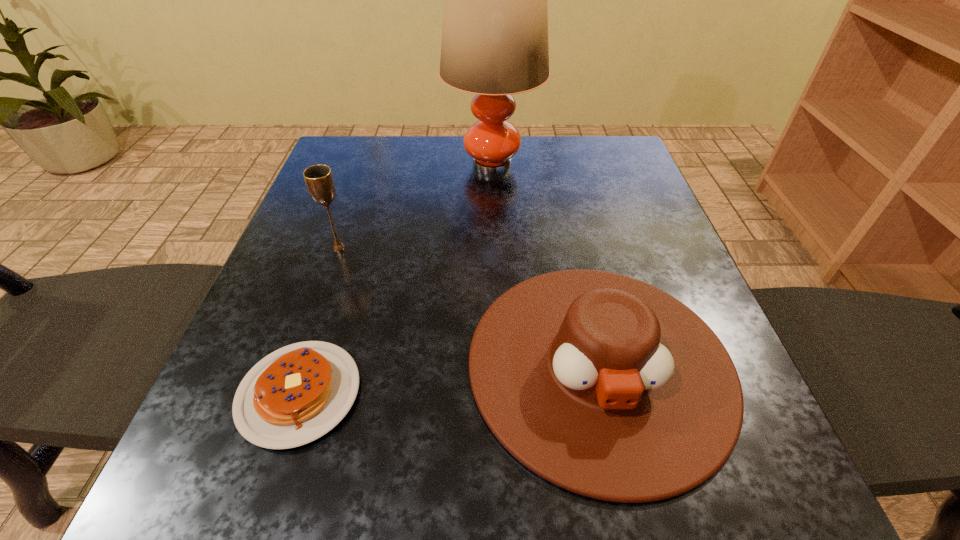
You are a GUI agent. You are given a task and a screenshot of the screen. Output one action in this format:
    pyautogui.click(x=<x>, y=<y>)
    Task: Click on the blank region between the shortest object and the third tallest object
    Image resolution: width=960 pixels, height=540 pixels.
    Given the screenshot: What is the action you would take?
    pyautogui.click(x=449, y=379)

Where is `free spot between the tallest object and the pancake`? This screenshot has width=960, height=540. free spot between the tallest object and the pancake is located at coordinates (396, 279).

Select which object appears as the third closest to the cowboy hat. Please provide its 2D coordinates. Your answer should be formatted as a tuple, i.e. [(x, y)], where the tuple contains the x and y coordinates of a point satisfying the conditions above.

[(494, 44)]

Locate an element on the screen. the second closest object to the shortest object is located at coordinates (319, 180).

Identify the location of vacant point that satisfies the following two spatial constraints: 1. on the front side of the second tallest object; 2. on the right side of the shortest object. (289, 394).